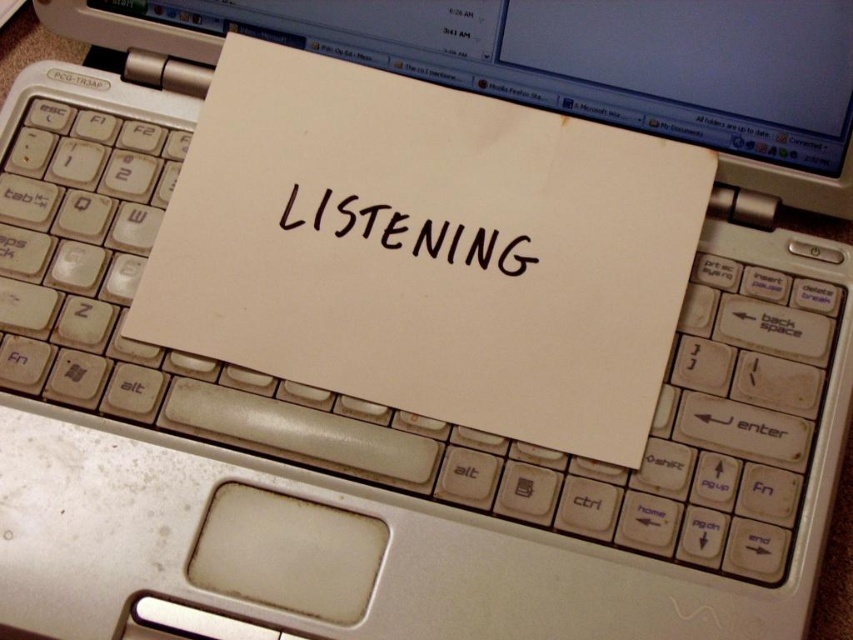
You are a graphic designer working on a project and need to place a new element between the white paper at center and the black handwritten text at center. Based on their positions, which object should you place the new element closer to?

The white paper at center is positioned on the right side of black handwritten text at center, so the new element should be placed closer to the black handwritten text at center to maintain alignment.

Based on the photo, you are setting up a presentation and need to know if the black handwritten text at center will fit entirely on the white paper at center. Can you confirm this?

The white paper at center is larger in size than the black handwritten text at center, so the text will fit entirely on the paper.

You are setting up a presentation and need to ensure that the white paper at center and black handwritten text at center are visible to the audience. Which object is taller and will block the view of the other?

The white paper at center is taller than black handwritten text at center, so it will block the view of the black handwritten text at center.